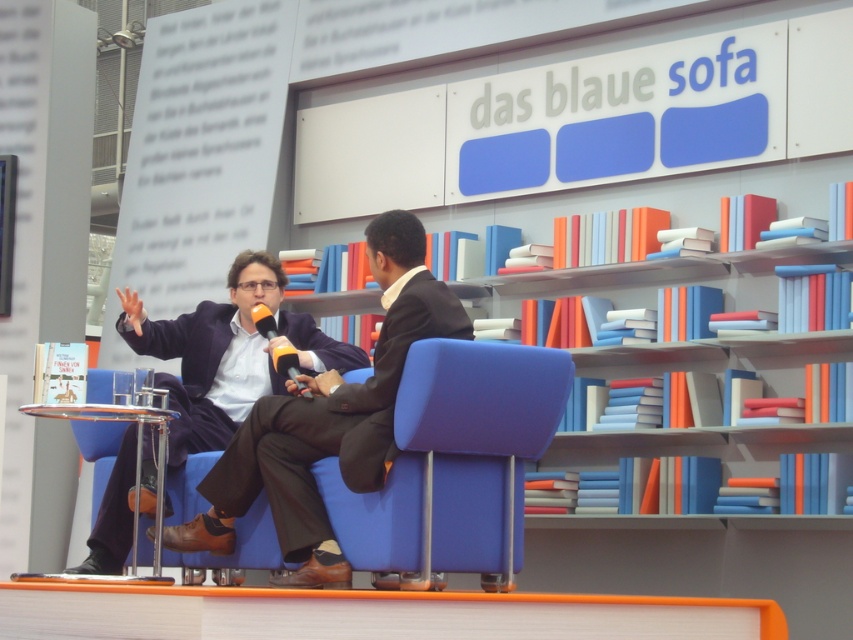
Is dark brown woolen suit at center in front of matte yellow microphone at center?

Yes.

Does dark brown woolen suit at center appear on the right side of matte yellow microphone at center?

Yes, dark brown woolen suit at center is to the right of matte yellow microphone at center.

At what (x,y) coordinates should I click in order to perform the action: click on dark brown woolen suit at center. Please return your answer as a coordinate pair (x, y). The height and width of the screenshot is (640, 853). Looking at the image, I should click on (325, 429).

Image resolution: width=853 pixels, height=640 pixels. In order to click on dark brown woolen suit at center in this screenshot , I will do `click(325, 429)`.

Is point (428, 273) farther from camera compared to point (105, 490)?

That is False.

Can you confirm if dark brown woolen suit at center is shorter than dark blue fabric business suit at center?

Incorrect, dark brown woolen suit at center's height does not fall short of dark blue fabric business suit at center's.

Does point (297, 445) come closer to viewer compared to point (132, 445)?

Yes, point (297, 445) is closer to viewer.

Where is `dark brown woolen suit at center`? dark brown woolen suit at center is located at coordinates (325, 429).

Can you confirm if dark blue fabric business suit at center is taller than matte yellow microphone at center?

Yes.

Between point (175, 464) and point (277, 369), which one is positioned in front?

Positioned in front is point (277, 369).

Where is `dark blue fabric business suit at center`? The width and height of the screenshot is (853, 640). dark blue fabric business suit at center is located at coordinates (189, 372).